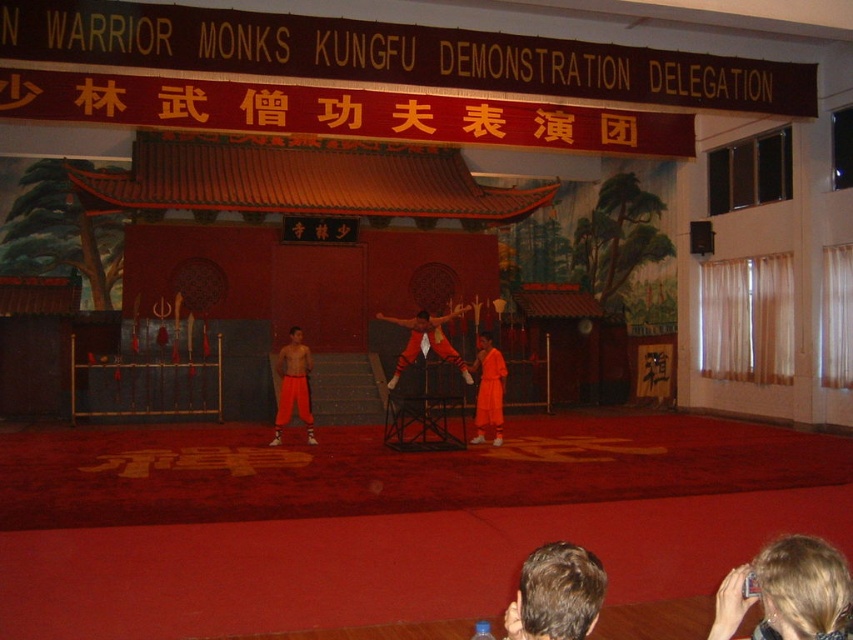
Question: Among these points, which one is nearest to the camera?

Choices:
 (A) (397, 364)
 (B) (479, 358)
 (C) (838, 596)

Answer: (C)

Question: Estimate the real-world distances between objects in this image. Which object is closer to the orange cloth at center?

Choices:
 (A) brown hair at lower center
 (B) blonde hair at lower right

Answer: (B)

Question: Which object appears farthest from the camera in this image?

Choices:
 (A) brown hair at lower center
 (B) orange cloth at center

Answer: (B)

Question: Is brown hair at lower center positioned before matte red pants at center?

Choices:
 (A) no
 (B) yes

Answer: (B)

Question: Is blonde hair at lower right wider than matte red pants at center?

Choices:
 (A) no
 (B) yes

Answer: (A)

Question: Does blonde hair at lower right have a lesser width compared to orange cloth at center?

Choices:
 (A) yes
 (B) no

Answer: (A)